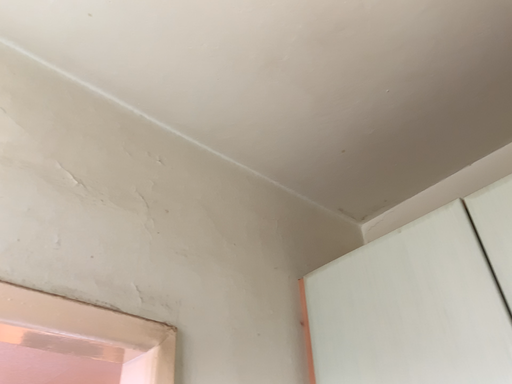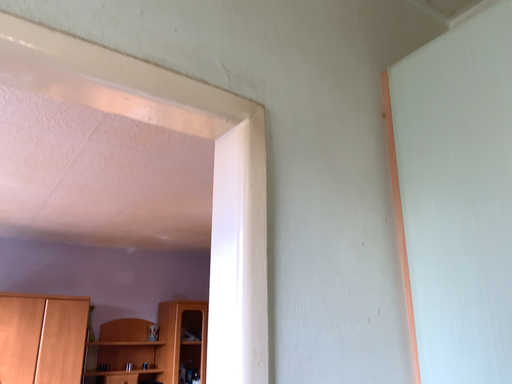
Question: Which way did the camera rotate in the video?

Choices:
 (A) rotated right
 (B) rotated left

Answer: (B)